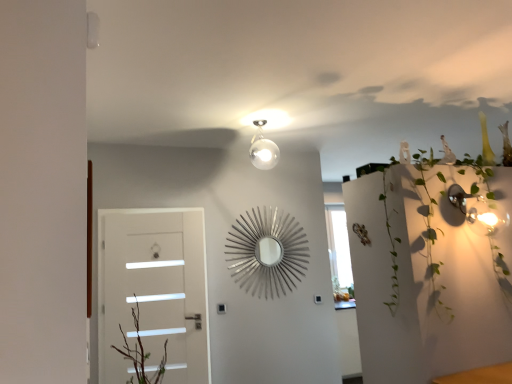
Describe the element at coordinates (480, 213) in the screenshot. This screenshot has height=384, width=512. I see `green leafy plant at upper right` at that location.

Locate an element on the screen. The height and width of the screenshot is (384, 512). green leafy plant at upper right is located at coordinates (480, 213).

Locate an element on the screen. Image resolution: width=512 pixels, height=384 pixels. white glossy door at left is located at coordinates (153, 292).

The height and width of the screenshot is (384, 512). What do you see at coordinates (153, 292) in the screenshot?
I see `white glossy door at left` at bounding box center [153, 292].

Locate an element on the screen. The height and width of the screenshot is (384, 512). green leafy plant at upper right is located at coordinates (480, 213).

Can you confirm if green leafy plant at upper right is positioned to the left of white glossy door at left?

In fact, green leafy plant at upper right is to the right of white glossy door at left.

From the picture: Between green leafy plant at upper right and white glossy door at left, which one is positioned in front?

green leafy plant at upper right.

Is point (450, 192) closer to viewer compared to point (153, 346)?

Yes, it is in front of point (153, 346).

From the image's perspective, is green leafy plant at upper right located above or below white glossy door at left?

green leafy plant at upper right is above white glossy door at left.

From a real-world perspective, between green leafy plant at upper right and white glossy door at left, who is vertically lower?

white glossy door at left is physically lower.

In the scene shown: Which of these two, green leafy plant at upper right or white glossy door at left, is wider?

green leafy plant at upper right.

Who is shorter, green leafy plant at upper right or white glossy door at left?

green leafy plant at upper right.

Between green leafy plant at upper right and white glossy door at left, which one has larger size?

With larger size is green leafy plant at upper right.

Could white glossy door at left be considered to be inside green leafy plant at upper right?

No, white glossy door at left is not surrounded by green leafy plant at upper right.

Is green leafy plant at upper right far away from white glossy door at left?

Absolutely, green leafy plant at upper right is distant from white glossy door at left.

Is green leafy plant at upper right oriented towards white glossy door at left?

No, green leafy plant at upper right is not turned towards white glossy door at left.

Identify the location of plant above the white glossy door at left (from the image's perspective). The width and height of the screenshot is (512, 384). (480, 213).

Considering the positions of objects white glossy door at left and green leafy plant at upper right in the image provided, who is more to the left, white glossy door at left or green leafy plant at upper right?

From the viewer's perspective, white glossy door at left appears more on the left side.

Which object is more forward, white glossy door at left or green leafy plant at upper right?

green leafy plant at upper right is in front.

Looking at this image, which point is more distant from viewer, (161,232) or (450,189)?

The point (161,232) is more distant.

From the image's perspective, which object appears higher, white glossy door at left or green leafy plant at upper right?

green leafy plant at upper right, from the image's perspective.

From a real-world perspective, is white glossy door at left over green leafy plant at upper right?

No, from a real-world perspective, white glossy door at left is not above green leafy plant at upper right.

Which object is wider, white glossy door at left or green leafy plant at upper right?

With larger width is green leafy plant at upper right.

Is white glossy door at left shorter than green leafy plant at upper right?

No, white glossy door at left is not shorter than green leafy plant at upper right.

Is white glossy door at left bigger than green leafy plant at upper right?

Incorrect, white glossy door at left is not larger than green leafy plant at upper right.

Does white glossy door at left contain green leafy plant at upper right?

No.

Are white glossy door at left and green leafy plant at upper right making contact?

No, white glossy door at left is not with green leafy plant at upper right.

Is white glossy door at left aimed at green leafy plant at upper right?

No, white glossy door at left does not turn towards green leafy plant at upper right.

What's the angular difference between white glossy door at left and green leafy plant at upper right's facing directions?

23.1 degrees separate the facing orientations of white glossy door at left and green leafy plant at upper right.

Identify the location of plant lying in front of the white glossy door at left. (480, 213).

The image size is (512, 384). In order to click on plant in front of the white glossy door at left in this screenshot , I will do `click(480, 213)`.

The height and width of the screenshot is (384, 512). In order to click on door below the green leafy plant at upper right (from a real-world perspective) in this screenshot , I will do `click(153, 292)`.